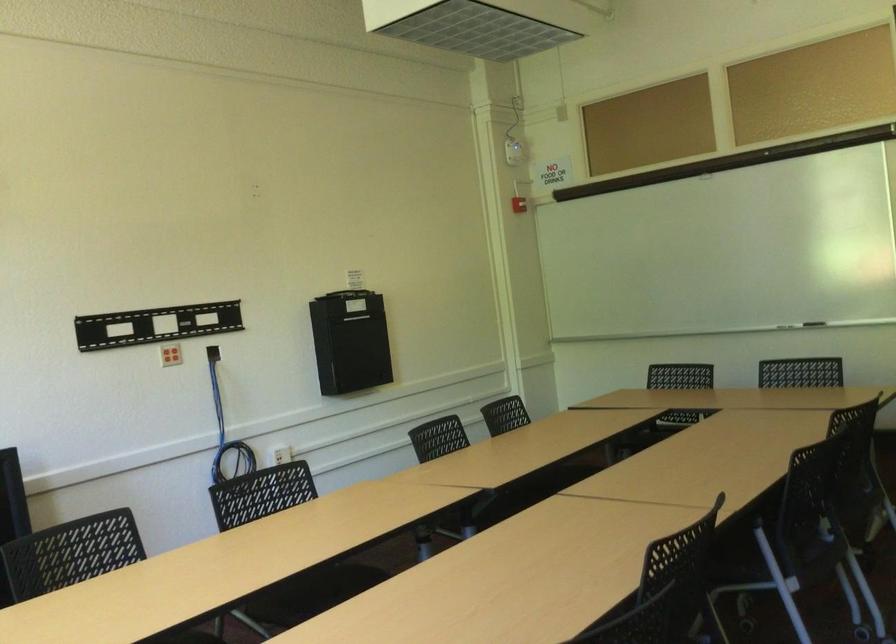
The width and height of the screenshot is (896, 644). What do you see at coordinates (519, 204) in the screenshot? I see `the red fire alarm handle` at bounding box center [519, 204].